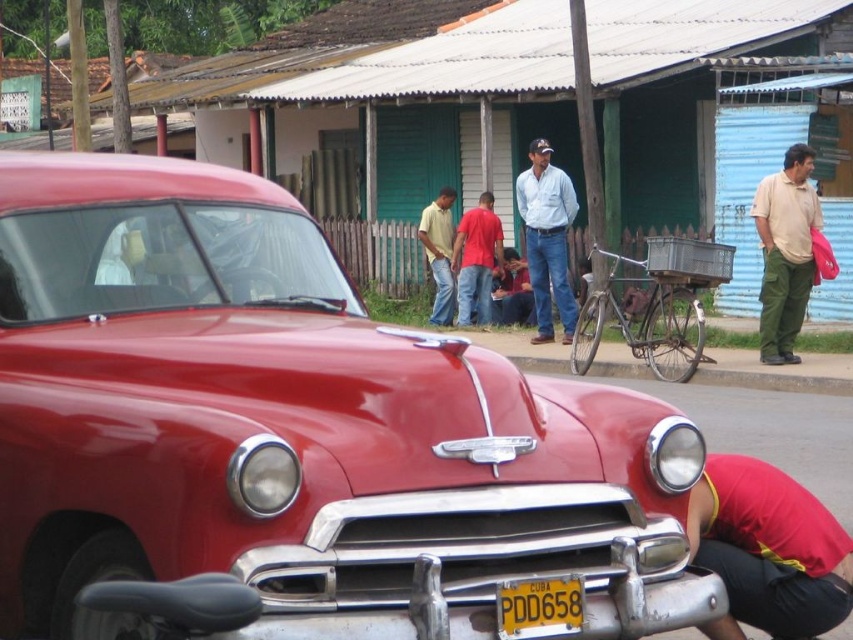
Which is below, light blue denim shirt at center or gray concrete curb at lower center?

gray concrete curb at lower center is below.

Can you confirm if light blue denim shirt at center is wider than gray concrete curb at lower center?

Incorrect, light blue denim shirt at center's width does not surpass gray concrete curb at lower center's.

The image size is (853, 640). What are the coordinates of `light blue denim shirt at center` in the screenshot? It's located at (547, 237).

The width and height of the screenshot is (853, 640). In order to click on light blue denim shirt at center in this screenshot , I will do `click(547, 237)`.

Does red fabric squat at lower right have a larger size compared to gray concrete curb at lower center?

Incorrect, red fabric squat at lower right is not larger than gray concrete curb at lower center.

Can you confirm if red fabric squat at lower right is taller than gray concrete curb at lower center?

Correct, red fabric squat at lower right is much taller as gray concrete curb at lower center.

Does point (734, 636) come closer to viewer compared to point (846, 384)?

Yes.

The height and width of the screenshot is (640, 853). I want to click on red fabric squat at lower right, so click(769, 548).

Does glossy red car at center have a greater width compared to matte yellow shirt at center?

Yes.

Which is below, glossy red car at center or matte yellow shirt at center?

Positioned lower is glossy red car at center.

Is point (592, 515) positioned after point (447, 305)?

No, (592, 515) is in front of (447, 305).

Locate an element on the screen. This screenshot has height=640, width=853. glossy red car at center is located at coordinates (294, 429).